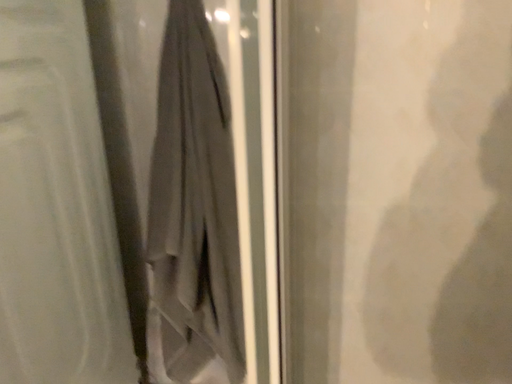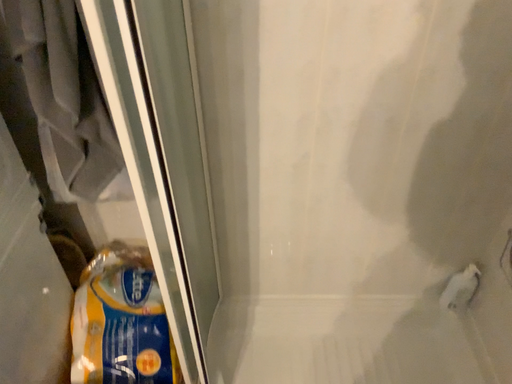
Question: Which way did the camera rotate in the video?

Choices:
 (A) rotated downward
 (B) rotated upward

Answer: (A)